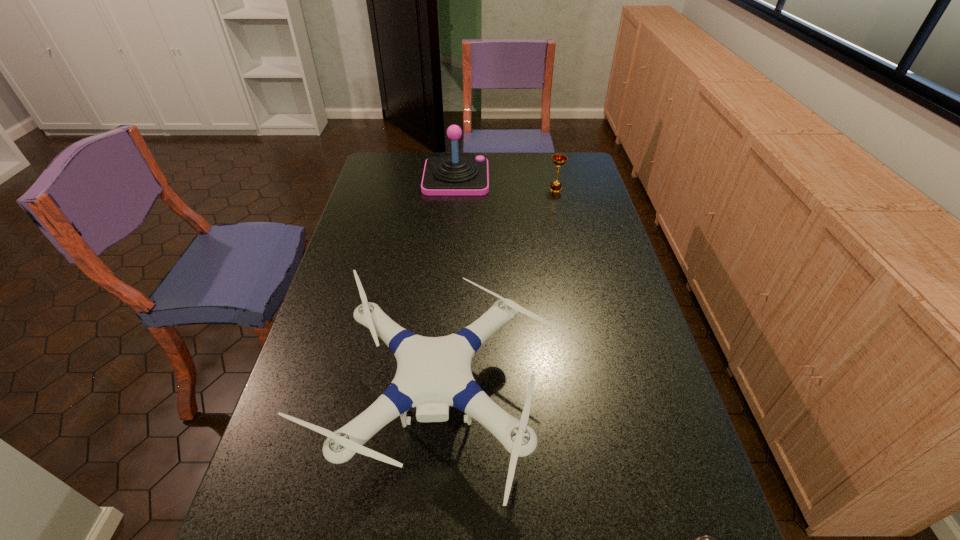
The width and height of the screenshot is (960, 540). Identify the location of the tallest object. (454, 175).

In order to click on chalice in this screenshot , I will do `click(558, 159)`.

This screenshot has height=540, width=960. I want to click on vacant area situated 0.120m forward from the base of the joystick, so click(517, 178).

At what (x,y) coordinates should I click in order to perform the action: click on vacant space situated 0.220m on the back of the chalice. Please return your answer as a coordinate pair (x, y). Image resolution: width=960 pixels, height=540 pixels. Looking at the image, I should click on [548, 158].

Where is `object at the far edge`? This screenshot has width=960, height=540. object at the far edge is located at coordinates (454, 175).

I want to click on object present at the right edge, so click(x=558, y=159).

You are a GUI agent. You are given a task and a screenshot of the screen. Output one action in this format:
    pyautogui.click(x=<x>, y=<y>)
    Task: Click on the vacant space at the far edge of the desktop
    The width and height of the screenshot is (960, 540).
    Given the screenshot: What is the action you would take?
    pyautogui.click(x=525, y=153)

Where is `vacant area at the left edge`? The height and width of the screenshot is (540, 960). vacant area at the left edge is located at coordinates (306, 518).

Where is `free space at the right edge`? The width and height of the screenshot is (960, 540). free space at the right edge is located at coordinates (653, 345).

The image size is (960, 540). Identify the location of empty space that is in between the tallest object and the second object from right to left. (506, 184).